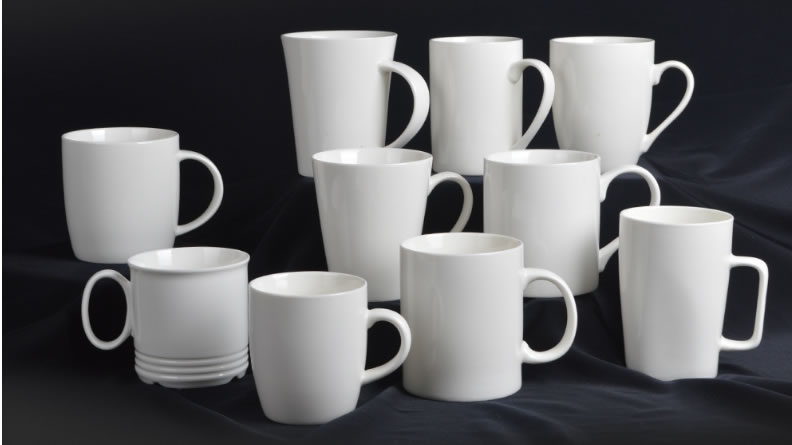
Locate an element on the screen. This screenshot has height=445, width=792. mug handles is located at coordinates (215, 189), (84, 296), (390, 315), (566, 309), (759, 262), (606, 181), (448, 179), (400, 68), (535, 65), (665, 67).